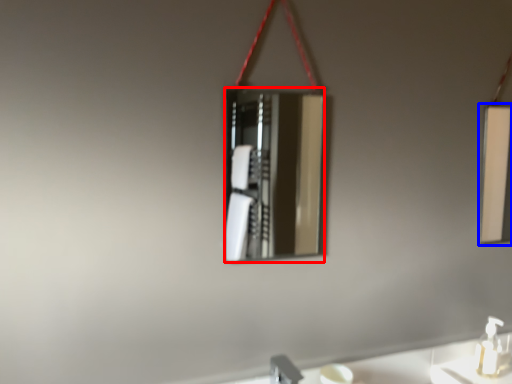
Question: Which object appears farthest to the camera in this image, mirror (highlighted by a red box) or mirror (highlighted by a blue box)?

Choices:
 (A) mirror
 (B) mirror

Answer: (B)